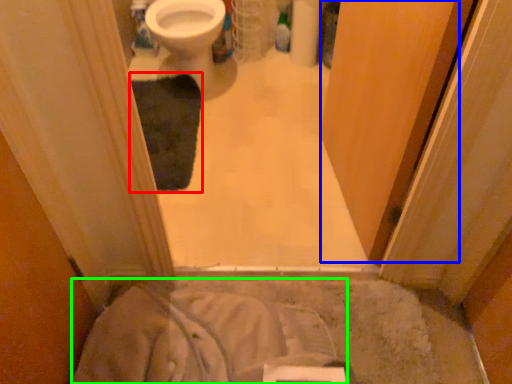
Question: Which is nearer to the bath mat (highlighted by a red box)? screen door (highlighted by a blue box) or sheet (highlighted by a green box).

Choices:
 (A) screen door
 (B) sheet

Answer: (A)